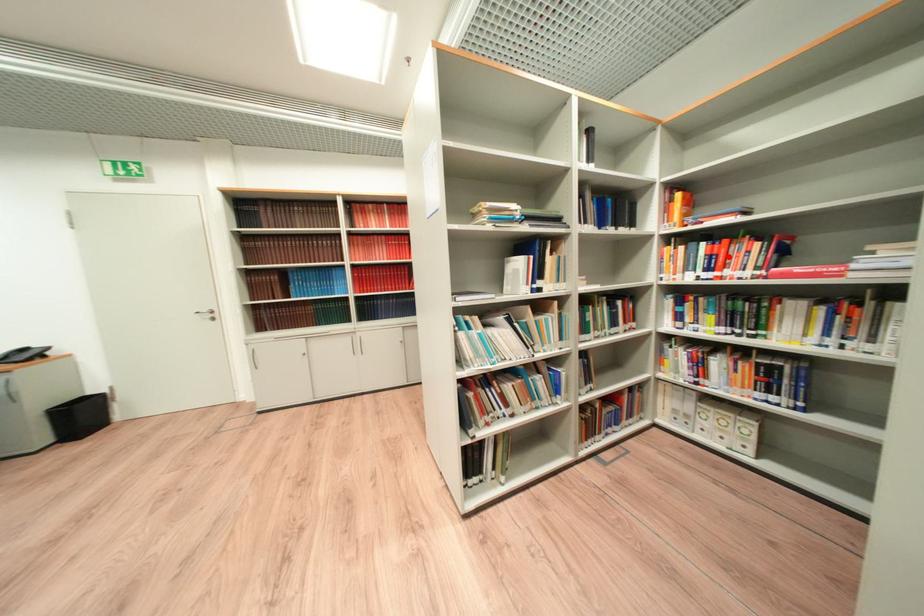
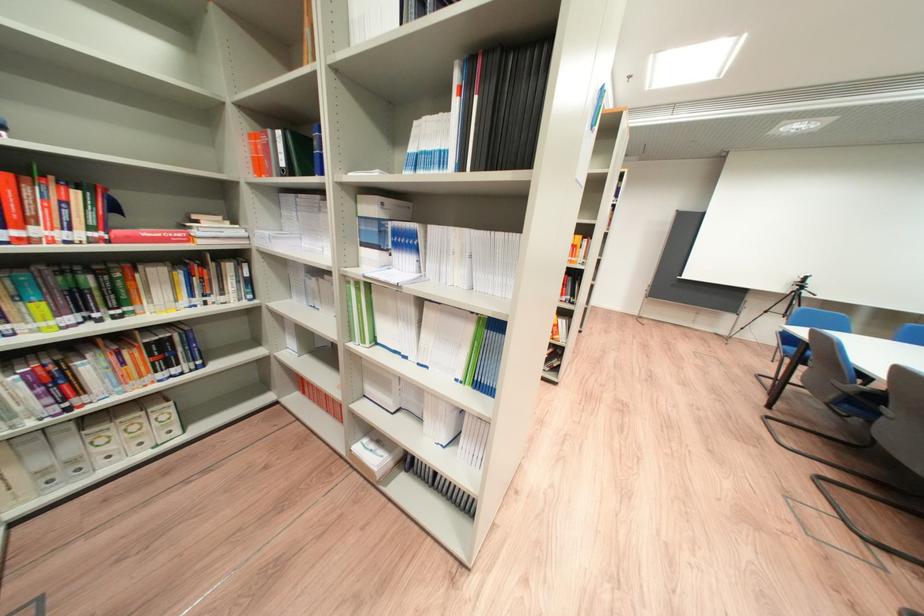
Where in the second image is the point corresponding to the highlighted location from the first image?

(9, 201)